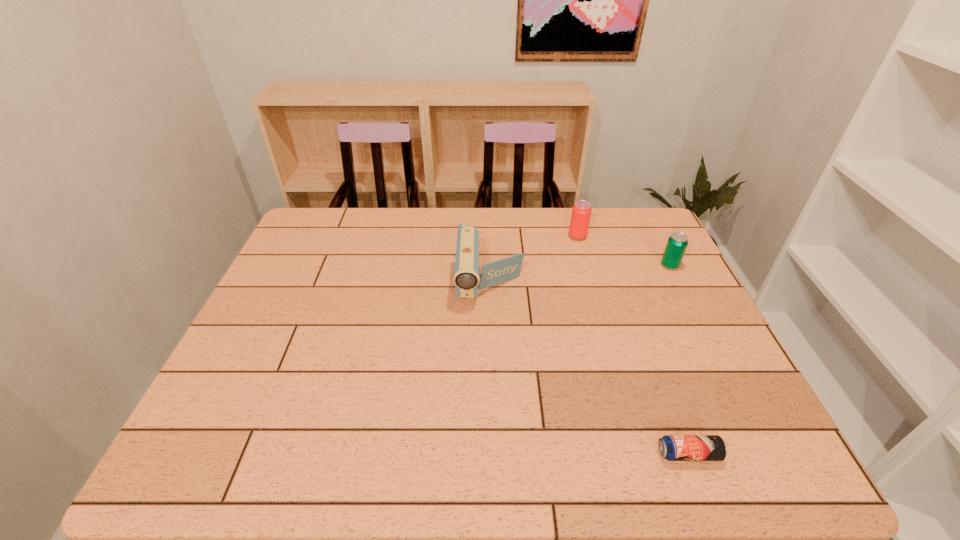
Where is `object that is the closest to the camcorder`? The height and width of the screenshot is (540, 960). object that is the closest to the camcorder is located at coordinates (581, 212).

You are a GUI agent. You are given a task and a screenshot of the screen. Output one action in this format:
    pyautogui.click(x=<x>, y=<y>)
    Task: Click on the beer can that is the second closest to the second nearest beer can
    The width and height of the screenshot is (960, 540).
    Given the screenshot: What is the action you would take?
    pyautogui.click(x=671, y=447)

Identify the location of the second closest beer can to the rightmost object. The width and height of the screenshot is (960, 540). (671, 447).

You are a GUI agent. You are given a task and a screenshot of the screen. Output one action in this format:
    pyautogui.click(x=<x>, y=<y>)
    Task: Click on the free space that satisfies the following two spatial constraints: 1. on the front side of the rightmost object; 2. on the left side of the leftmost beer can
    Image resolution: width=960 pixels, height=540 pixels.
    Given the screenshot: What is the action you would take?
    pyautogui.click(x=586, y=265)